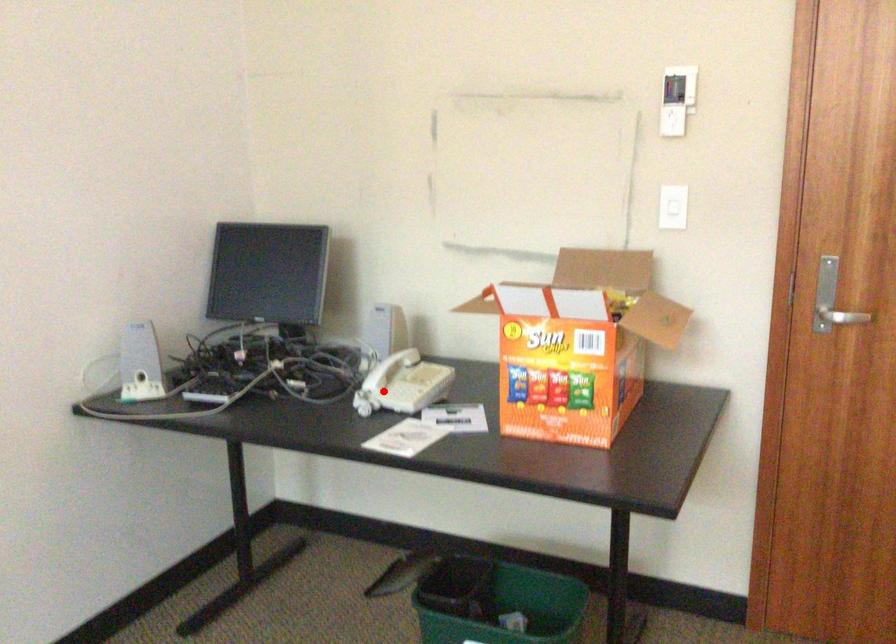
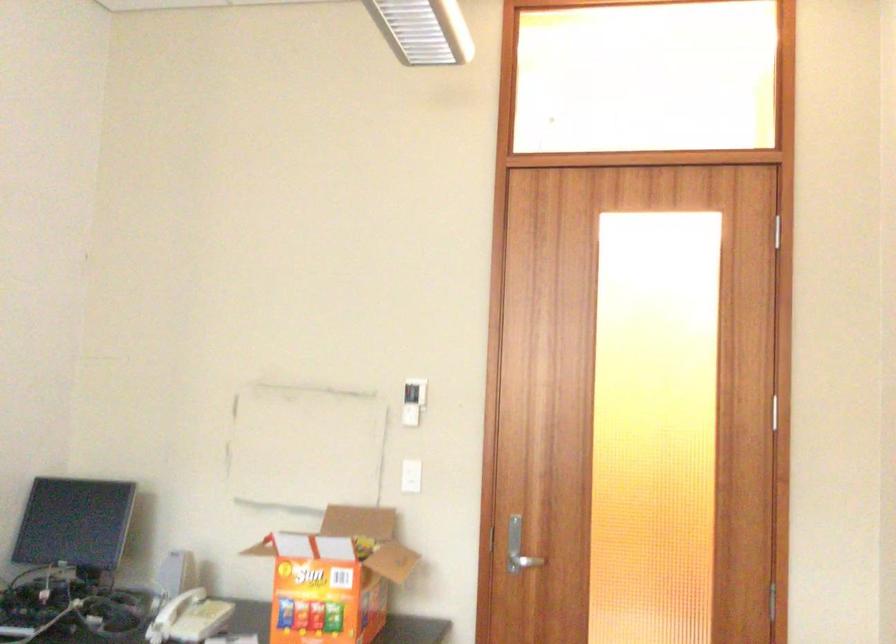
In the second image, find the point that corresponds to the highlighted location in the first image.

(170, 617)